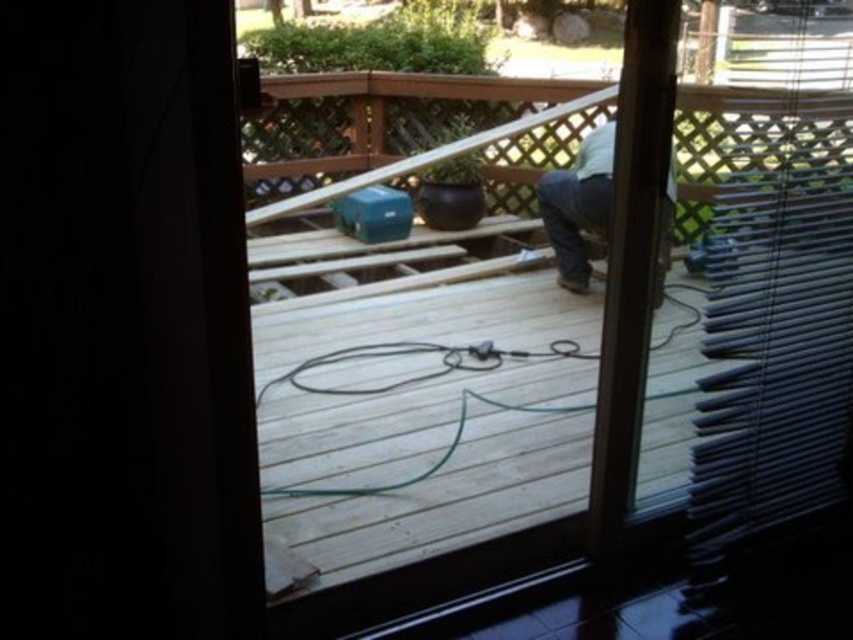
Can you confirm if transparent glass door at center is positioned to the left of light brown wood pants at center?

Yes, transparent glass door at center is to the left of light brown wood pants at center.

Which is in front, point (654, 458) or point (582, 156)?

Point (654, 458)

Where is `transparent glass door at center`? transparent glass door at center is located at coordinates (439, 529).